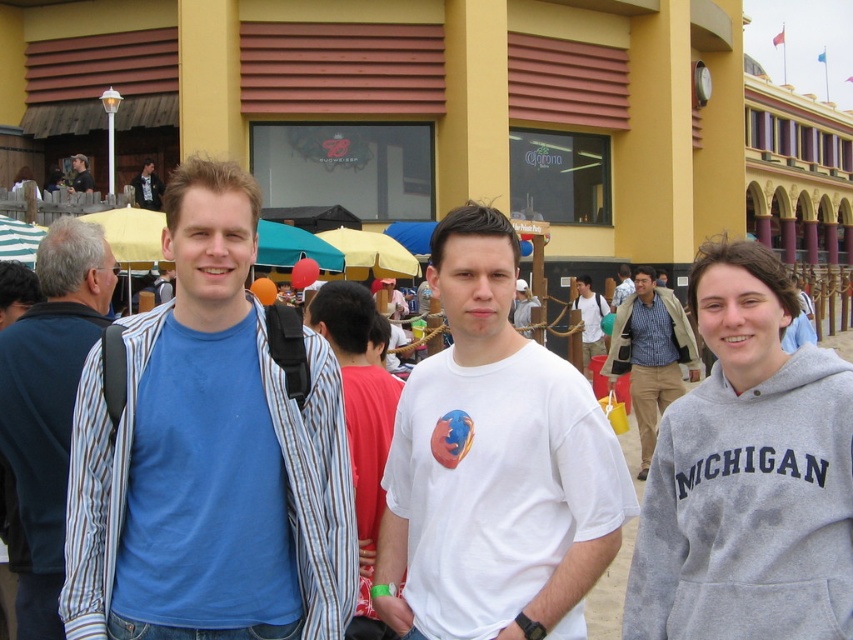
Based on the photo, you are a photographer trying to capture a wide shot of the event. Your camera has a maximum focus range of 100 feet. Can you include both the blue striped shirt at left and the matte black shirt at upper left in the same focused shot?

The distance between the blue striped shirt at left and the matte black shirt at upper left is 124.76 feet. Since your camera can only focus up to 100 feet, you cannot include both in the same focused shot.

You are a photographer positioned at the center of the scene. You want to capture a photo that includes both the gray fleece sweatshirt at right and the blue striped shirt at left. Given that your camera has a maximum zoom range of 10 meters, will you be able to fit both subjects into the frame without moving closer?

The distance between the gray fleece sweatshirt at right and the blue striped shirt at left is 12.20 meters. Since your camera can only zoom up to 10 meters, you won t be able to fit both subjects into the frame without moving closer.